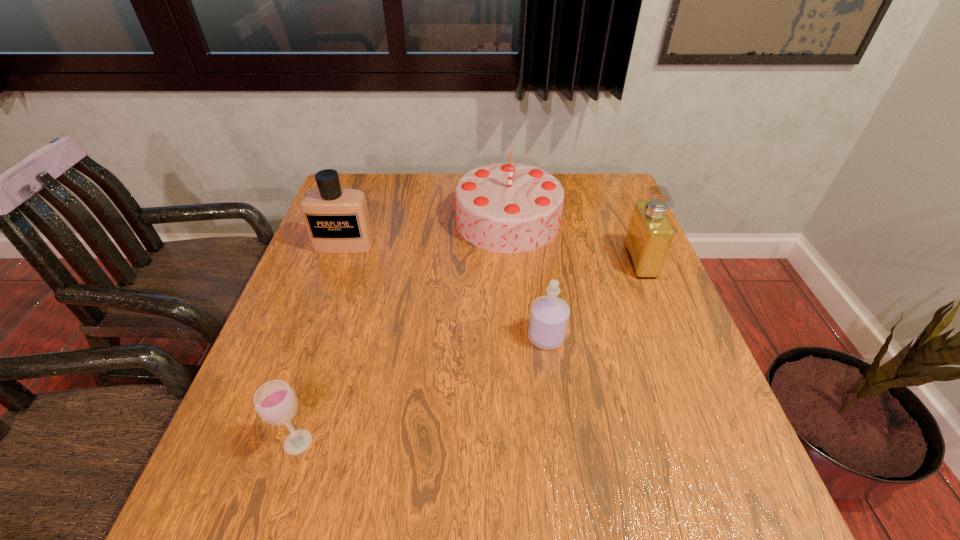
What are the coordinates of `birthday cake` in the screenshot? It's located at (507, 207).

What are the coordinates of `the leftmost perfume` in the screenshot? It's located at (337, 220).

The image size is (960, 540). I want to click on the rightmost perfume, so click(x=649, y=235).

Where is `the second perfume from right to left`? The width and height of the screenshot is (960, 540). the second perfume from right to left is located at coordinates (549, 315).

Find the location of a particular element. the nearest perfume is located at coordinates (549, 315).

Identify the location of the nearest object. (275, 402).

Image resolution: width=960 pixels, height=540 pixels. Find the location of `free space located 0.050m on the right of the birthday cake`. free space located 0.050m on the right of the birthday cake is located at coordinates (579, 220).

Where is `free spot located 0.130m on the front label of the leftmost perfume`? The height and width of the screenshot is (540, 960). free spot located 0.130m on the front label of the leftmost perfume is located at coordinates (329, 288).

Where is `vacant region located 0.070m on the front-facing side of the rightmost perfume`? vacant region located 0.070m on the front-facing side of the rightmost perfume is located at coordinates (602, 261).

At what (x,y) coordinates should I click in order to perform the action: click on vacant region located on the front-facing side of the rightmost perfume. Please return your answer as a coordinate pair (x, y). Looking at the image, I should click on (477, 261).